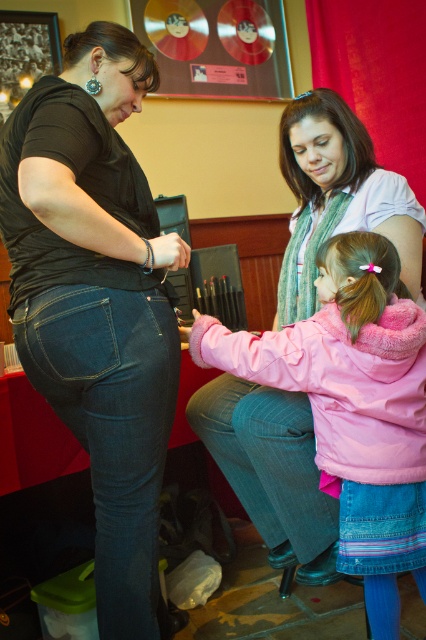
You are a photographer who needs to capture a closeup of the black matte jeans at center. Your camera requires you to be at least 40 inches away to avoid distortion. Can you take the photo from your current position?

The black matte jeans at center and camera are 39.33 inches apart from each other, so you are too close to take the photo without distortion.

You are standing in the room and want to determine which of the two points, point (x=365, y=276) or point (x=360, y=168), is closer to you. Based on the scene description, which point is nearer?

Point (x=365, y=276) is closer to the camera than point (x=360, y=168), so it is nearer to you.